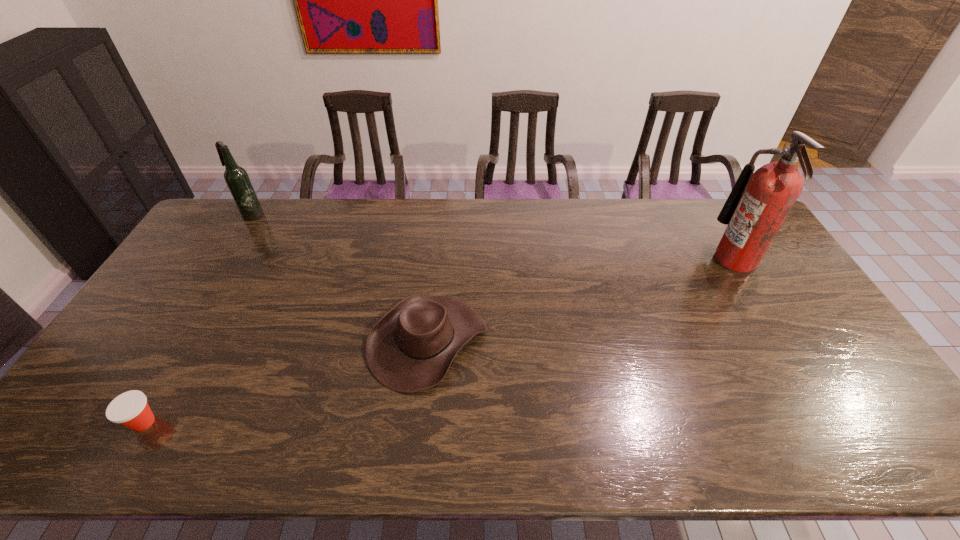
The height and width of the screenshot is (540, 960). Identify the location of vacant region located on the front of the rightmost object near the operation label. (642, 260).

Locate an element on the screen. This screenshot has width=960, height=540. vacant space located 0.310m on the right of the beer bottle is located at coordinates (348, 215).

Identify the location of free space located 0.390m on the right of the third farthest object. (627, 341).

Locate an element on the screen. Image resolution: width=960 pixels, height=540 pixels. vacant space situated on the back of the shortest object is located at coordinates (174, 369).

Find the location of a particular element. object at the far edge is located at coordinates (237, 179).

Identify the location of object that is at the near edge. The height and width of the screenshot is (540, 960). (130, 409).

Image resolution: width=960 pixels, height=540 pixels. I want to click on beer bottle that is at the left edge, so click(x=237, y=179).

The width and height of the screenshot is (960, 540). Identify the location of Dixie cup situated at the left edge. (130, 409).

Where is `object present at the right edge`? The width and height of the screenshot is (960, 540). object present at the right edge is located at coordinates (760, 201).

Identify the location of object present at the far left corner. This screenshot has width=960, height=540. (237, 179).